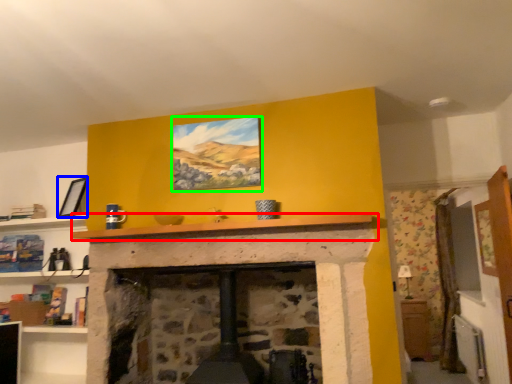
Question: Considering the real-world distances, which object is closest to mantle (highlighted by a red box)? picture frame (highlighted by a blue box) or picture frame (highlighted by a green box).

Choices:
 (A) picture frame
 (B) picture frame

Answer: (B)